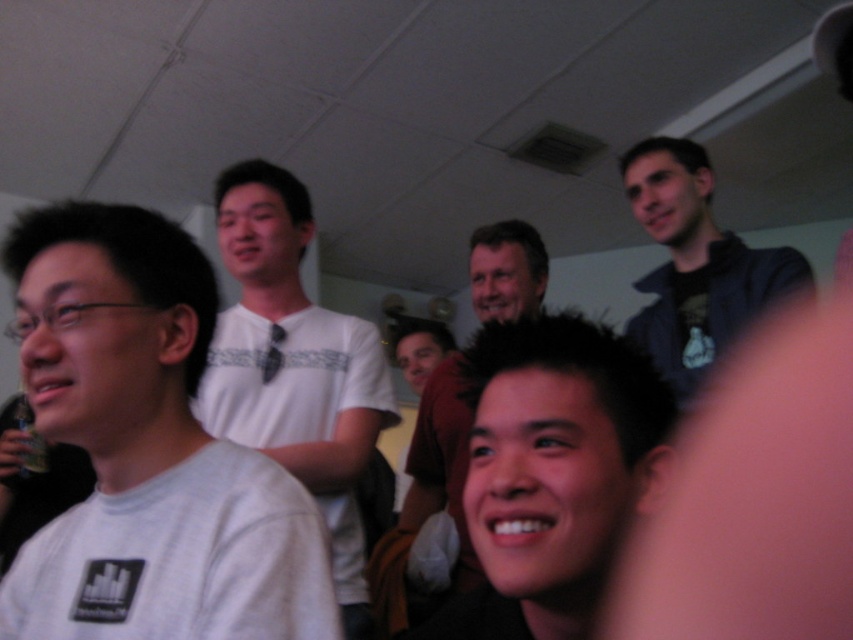
Is white matte shirt at left shorter than smooth skin face at center?

Yes.

Is point (236, 522) behind point (393, 616)?

No, (236, 522) is closer to viewer.

Is point (148, 323) closer to camera compared to point (476, 253)?

Yes, point (148, 323) is closer to viewer.

Where is `white matte shirt at left`? This screenshot has width=853, height=640. white matte shirt at left is located at coordinates pyautogui.click(x=148, y=451).

Can you confirm if white matte shirt at left is shorter than dark blue jacket at upper right?

Correct, white matte shirt at left is not as tall as dark blue jacket at upper right.

Does white matte shirt at left have a smaller size compared to dark blue jacket at upper right?

Indeed, white matte shirt at left has a smaller size compared to dark blue jacket at upper right.

Locate an element on the screen. white matte shirt at left is located at coordinates (148, 451).

The width and height of the screenshot is (853, 640). I want to click on white matte shirt at left, so click(x=148, y=451).

In the scene shown: Does white matte shirt at center appear under dark blue jacket at upper right?

Yes, white matte shirt at center is below dark blue jacket at upper right.

Which is in front, point (254, 449) or point (691, 316)?

Point (254, 449) is in front.

Image resolution: width=853 pixels, height=640 pixels. In order to click on white matte shirt at center in this screenshot , I will do `click(294, 365)`.